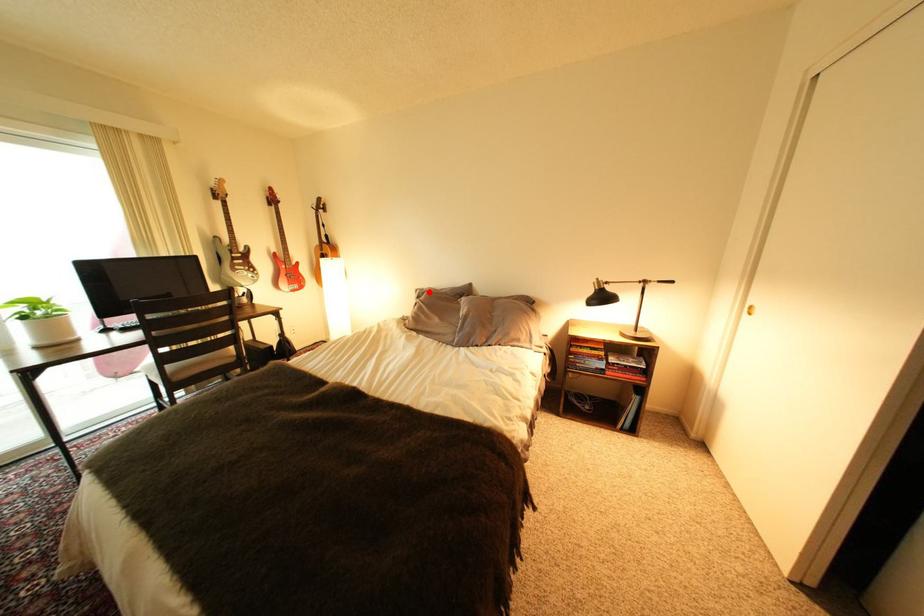
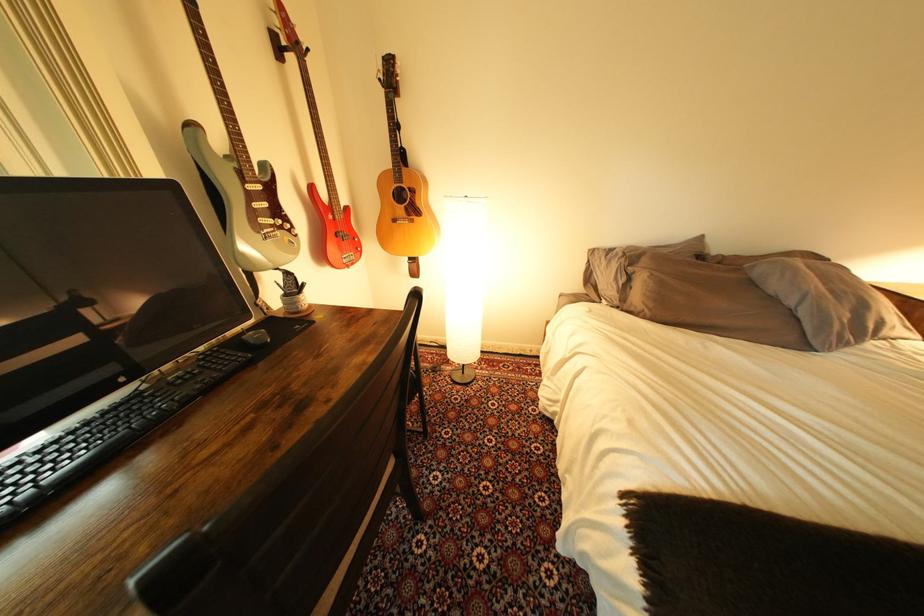
The point at the highlighted location is marked in the first image. Where is the corresponding point in the second image?

(604, 253)